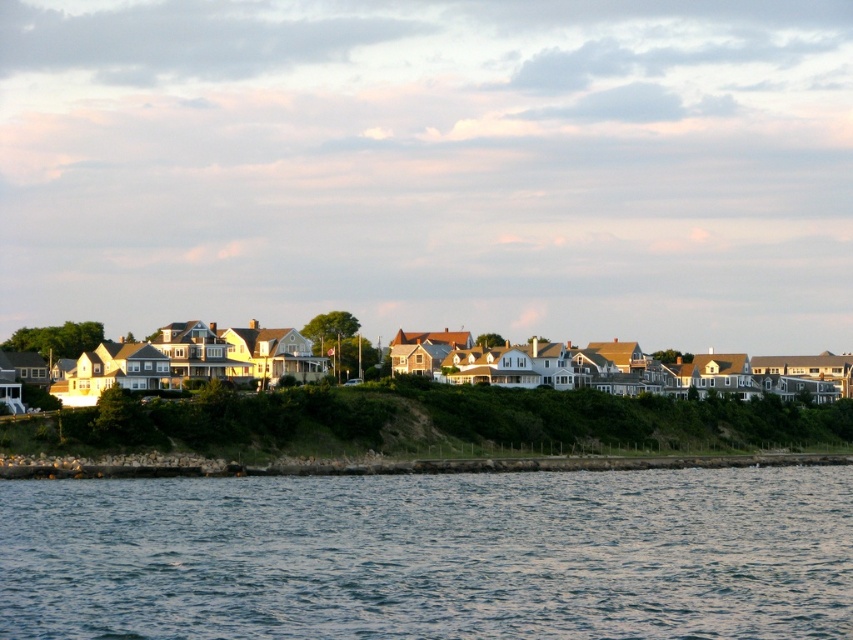
Consider the image. Is blue water at lower center positioned before green grassy hillside at lower center?

Yes.

Between point (784, 477) and point (90, 440), which one is positioned in front?

Point (90, 440) is more forward.

Describe the element at coordinates (432, 556) in the screenshot. I see `blue water at lower center` at that location.

At what (x,y) coordinates should I click in order to perform the action: click on blue water at lower center. Please return your answer as a coordinate pair (x, y). Looking at the image, I should click on (432, 556).